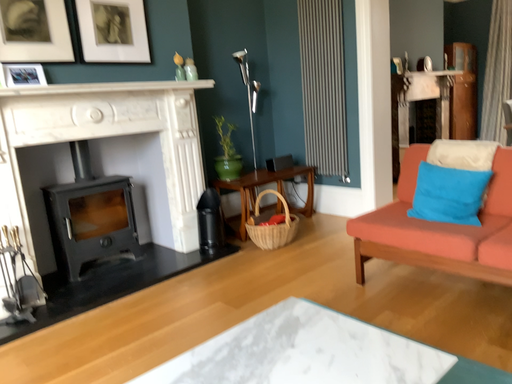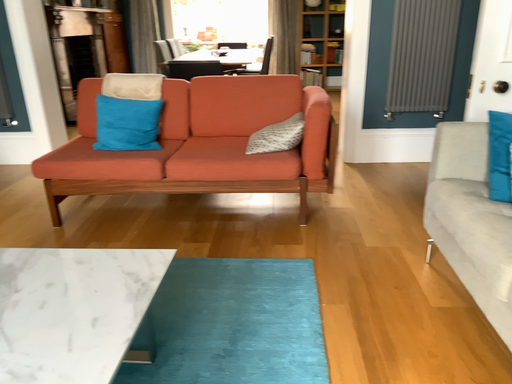
Question: Which way did the camera rotate in the video?

Choices:
 (A) rotated right
 (B) rotated left

Answer: (A)